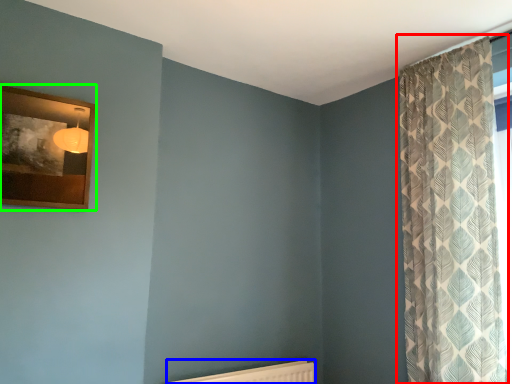
Question: Which object is the closest to the curtain (highlighted by a red box)? Choose among these: radiator (highlighted by a blue box) or picture frame (highlighted by a green box).

Choices:
 (A) radiator
 (B) picture frame

Answer: (A)